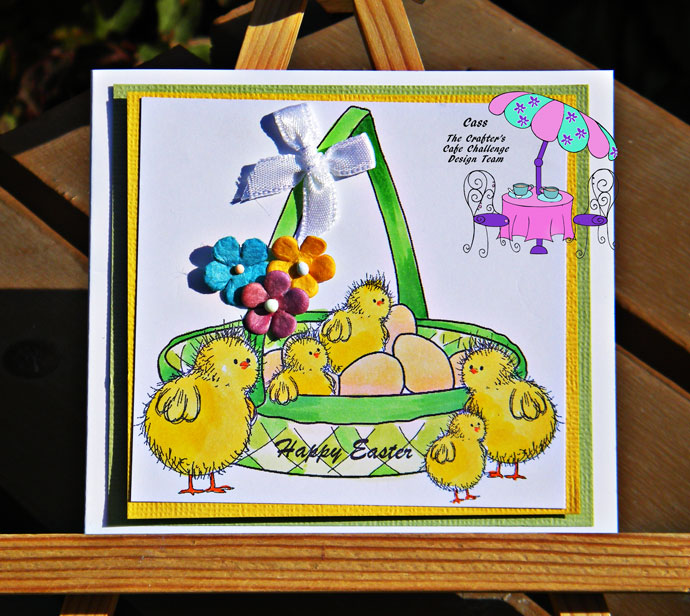
This screenshot has height=616, width=690. I want to click on chair with purple seats, so click(492, 225), click(591, 220).